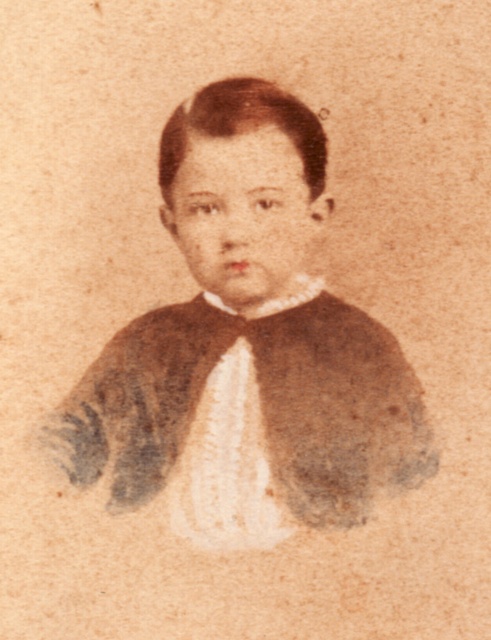
Question: Can you confirm if brown textured sweater at center is bigger than white textured bow tie at center?

Choices:
 (A) no
 (B) yes

Answer: (B)

Question: Which of the following is the closest to the observer?

Choices:
 (A) (287, 401)
 (B) (218, 296)

Answer: (A)

Question: Is brown textured sweater at center smaller than white textured bow tie at center?

Choices:
 (A) no
 (B) yes

Answer: (A)

Question: Among these objects, which one is nearest to the camera?

Choices:
 (A) brown textured sweater at center
 (B) white textured bow tie at center

Answer: (A)

Question: Which of the following is the farthest from the observer?

Choices:
 (A) brown textured sweater at center
 (B) white textured bow tie at center

Answer: (B)

Question: Is brown textured sweater at center wider than white textured bow tie at center?

Choices:
 (A) yes
 (B) no

Answer: (A)